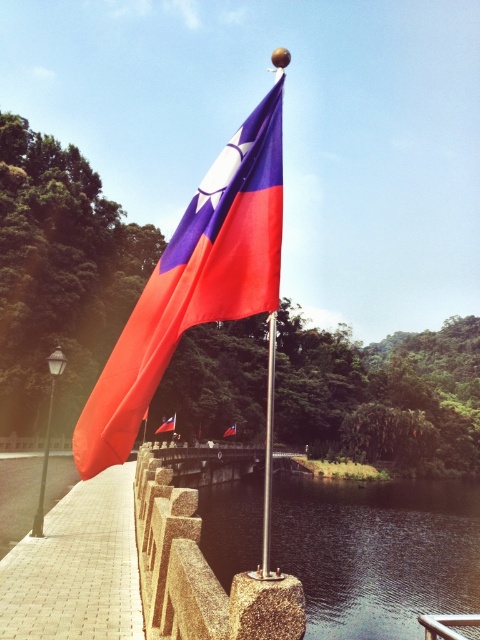
You are a maintenance worker tasked with placing a new metallic flag pole at center on the transparent glass river at lower center. Can you safely place the pole on the river without the pole falling through?

The transparent glass river at lower center is wider than the metallic flag pole at center, so yes, the pole can be safely placed on the river without falling through.

You are standing on the paved pathway and want to take a photo of the matte fabric flag at center and the metallic flag pole at center. Which object should you focus on first to ensure both are in sharp focus?

The matte fabric flag at center is further to the viewer than the metallic flag pole at center, so you should focus on the matte fabric flag at center first to ensure both are in sharp focus.

You are a visitor at a scenic walkway near water. You see two flags, the matte fabric flag at center and the red fabric flag at center. Which flag is wider?

The matte fabric flag at center is wider than the red fabric flag at center according to the description.